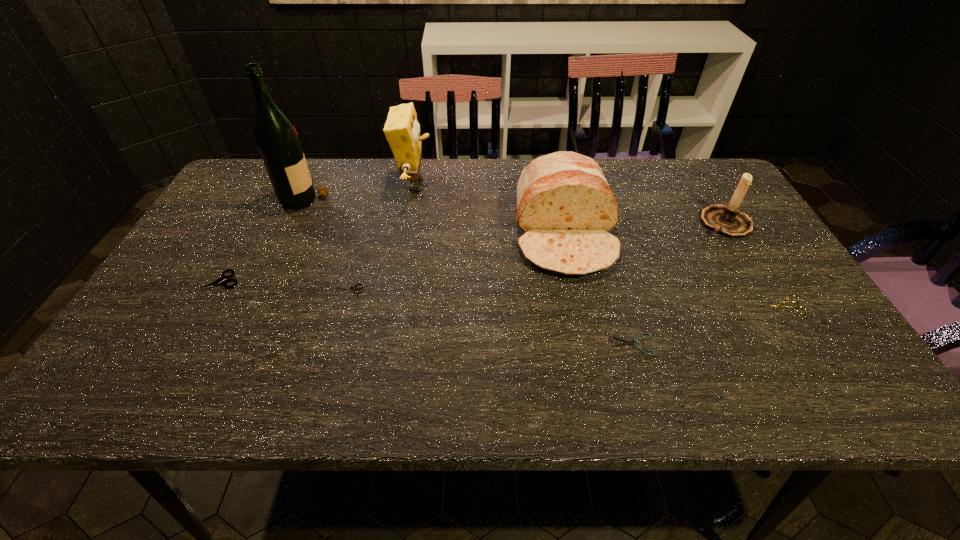
This screenshot has height=540, width=960. I want to click on vacant area at the far left corner of the desktop, so click(x=257, y=199).

Find the location of a particular element. The height and width of the screenshot is (540, 960). blank space at the far right corner is located at coordinates (705, 196).

At what (x,y) coordinates should I click in order to perform the action: click on vacant area that lies between the bread and the shortest object. Please return your answer as a coordinate pair (x, y). This screenshot has height=540, width=960. Looking at the image, I should click on (599, 289).

I want to click on blank region between the rightmost shears and the second shears from left to right, so click(x=563, y=297).

Identify the location of free area in between the nearest shears and the seventh shortest object. (524, 265).

Image resolution: width=960 pixels, height=540 pixels. Identify the location of free space between the second shears from left to right and the second tallest object. (380, 237).

Locate an element on the screen. The height and width of the screenshot is (540, 960). free space between the bread and the third object from left to right is located at coordinates (455, 261).

Where is `vacant space in between the leftmost shears and the bread`? The width and height of the screenshot is (960, 540). vacant space in between the leftmost shears and the bread is located at coordinates (393, 257).

Where is `free area in between the sixth object from right to left and the tallest shears`? Image resolution: width=960 pixels, height=540 pixels. free area in between the sixth object from right to left and the tallest shears is located at coordinates (283, 285).

The height and width of the screenshot is (540, 960). I want to click on vacant area that lies between the fifth tallest object and the wine bottle, so click(x=263, y=239).